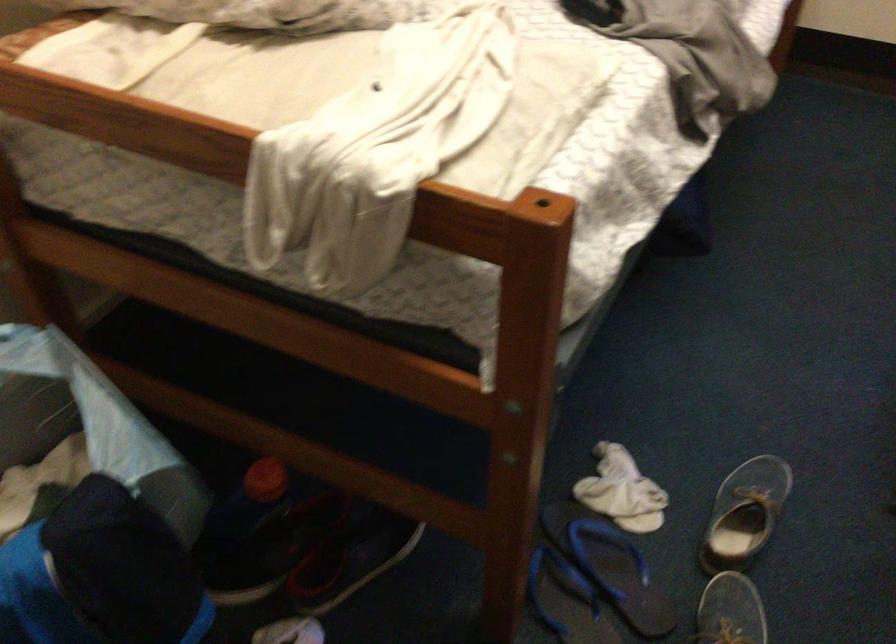
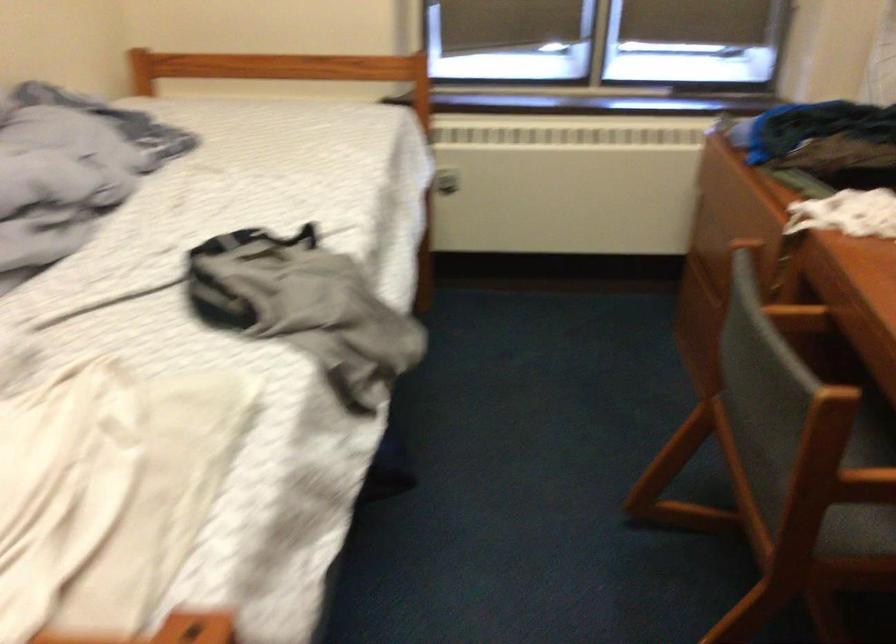
Question: How did the camera likely rotate?

Choices:
 (A) Left
 (B) Right
 (C) Up
 (D) Down

Answer: (B)